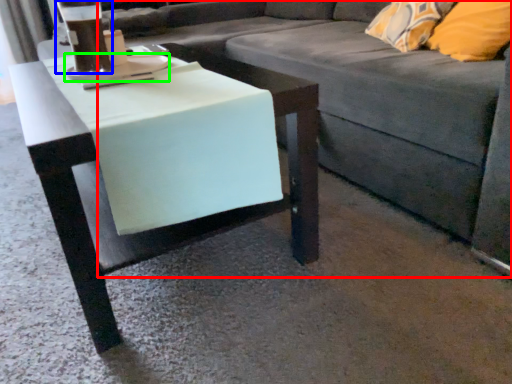
Question: Which is nearer to the studio couch (highlighted by a red box)? beverage (highlighted by a blue box) or saucer (highlighted by a green box).

Choices:
 (A) beverage
 (B) saucer

Answer: (B)